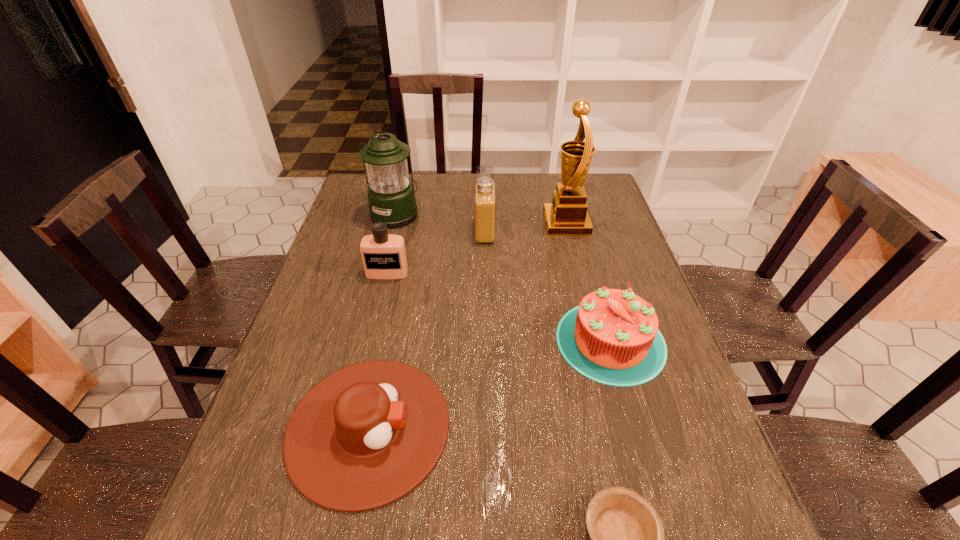
The width and height of the screenshot is (960, 540). Identify the location of free space between the award and the cowboy hat. (468, 325).

Find the location of a particular element. Image resolution: width=960 pixels, height=540 pixels. vacant space in between the cake and the cowboy hat is located at coordinates (490, 384).

Where is `free space between the cake and the tallest object`? free space between the cake and the tallest object is located at coordinates (588, 282).

Where is `free space between the sixth tallest object and the left perfume`? The height and width of the screenshot is (540, 960). free space between the sixth tallest object and the left perfume is located at coordinates (378, 350).

Locate which object is the third closest to the cake. Please provide its 2D coordinates. Your answer should be formatted as a tuple, i.e. [(x, y)], where the tuple contains the x and y coordinates of a point satisfying the conditions above.

[(485, 198)]

The width and height of the screenshot is (960, 540). Find the location of `object identified as the second closest to the cowboy hat`. object identified as the second closest to the cowboy hat is located at coordinates (612, 337).

Find the location of a particular element. vacant region that satisfies the following two spatial constraints: 1. on the front-facing side of the award; 2. on the front label of the fourth farthest object is located at coordinates pyautogui.click(x=579, y=273).

This screenshot has width=960, height=540. What are the coordinates of `vacant region that satisfies the following two spatial constraints: 1. on the front-facing side of the cake; 2. on the right side of the award` in the screenshot? It's located at (596, 341).

Identify the location of vacant position in the image that satisfies the following two spatial constraints: 1. on the front side of the cake; 2. on the front-facing side of the cowboy hat. The height and width of the screenshot is (540, 960). (635, 428).